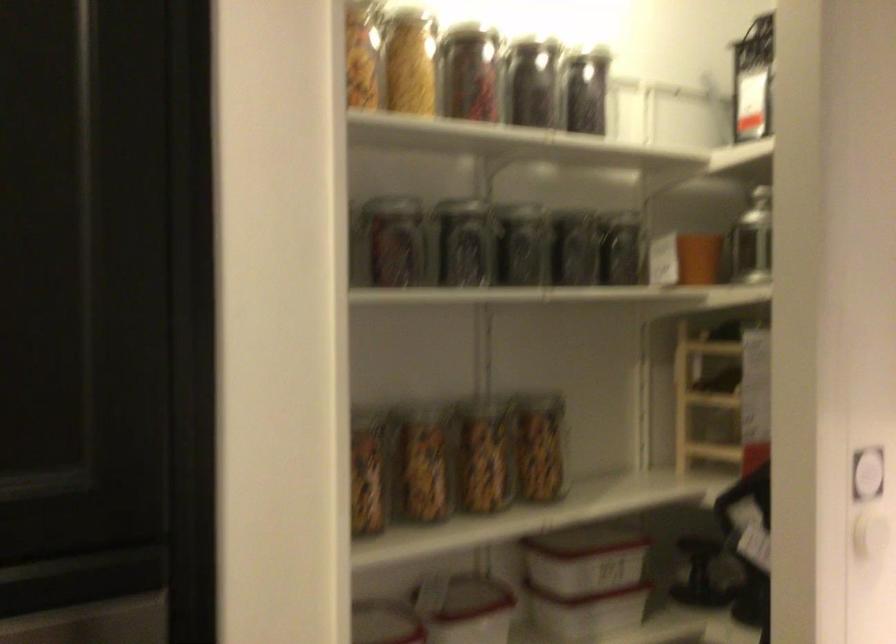
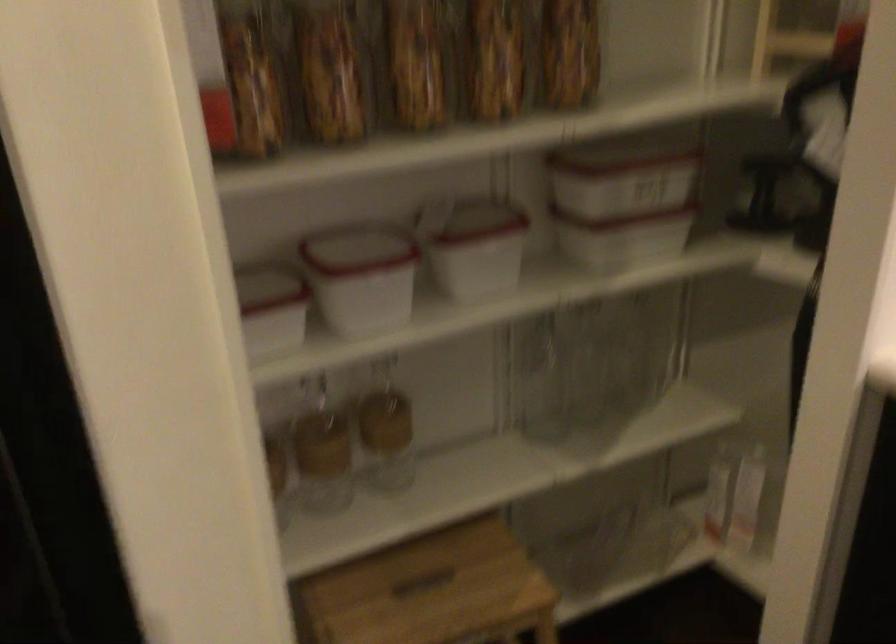
Question: How did the camera likely rotate?

Choices:
 (A) Left
 (B) Right
 (C) Up
 (D) Down

Answer: (D)